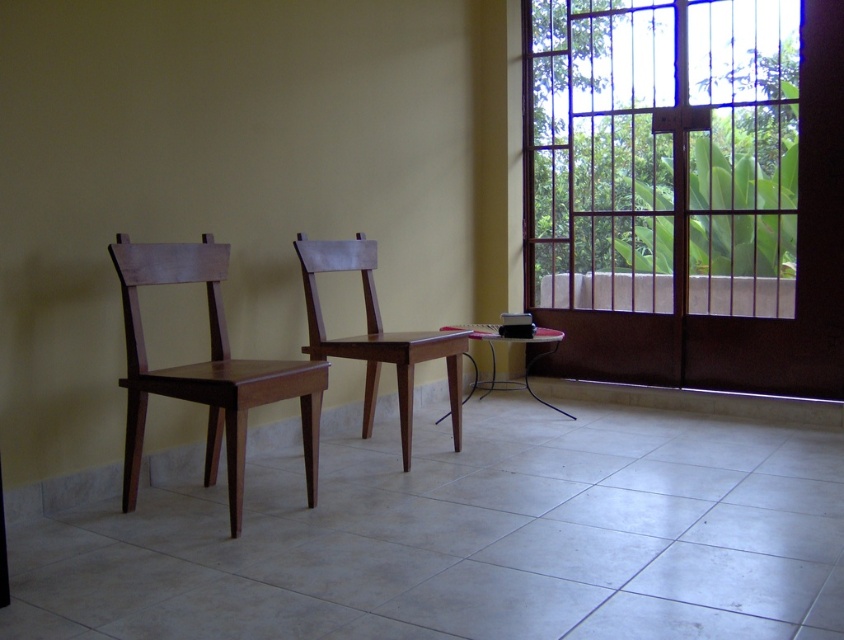
Between point (149, 257) and point (494, 380), which one is positioned in front?

Point (149, 257)

Does point (198, 262) come in front of point (468, 353)?

That is True.

Find the location of a particular element. Image resolution: width=844 pixels, height=640 pixels. matte wood chair at left is located at coordinates (206, 371).

You are a GUI agent. You are given a task and a screenshot of the screen. Output one action in this format:
    pyautogui.click(x=<x>, y=<y>)
    Task: Click on the matte wood chair at left
    
    Given the screenshot: What is the action you would take?
    pyautogui.click(x=206, y=371)

Can you confirm if matte wood chair at left is bigger than matte wood chair at center?

No, matte wood chair at left is not bigger than matte wood chair at center.

Between point (127, 372) and point (456, 344), which one is positioned in front?

Point (127, 372) is in front.

Is point (161, 273) positioned in front of point (377, 364)?

Yes, point (161, 273) is in front of point (377, 364).

Where is `matte wood chair at left`? matte wood chair at left is located at coordinates (206, 371).

Between clear glass window at upper right and matte wood chair at left, which one appears on the right side from the viewer's perspective?

From the viewer's perspective, clear glass window at upper right appears more on the right side.

Does clear glass window at upper right have a greater width compared to matte wood chair at left?

Indeed, clear glass window at upper right has a greater width compared to matte wood chair at left.

Is point (601, 144) positioned before point (176, 280)?

That is False.

Locate an element on the screen. The height and width of the screenshot is (640, 844). clear glass window at upper right is located at coordinates tap(661, 154).